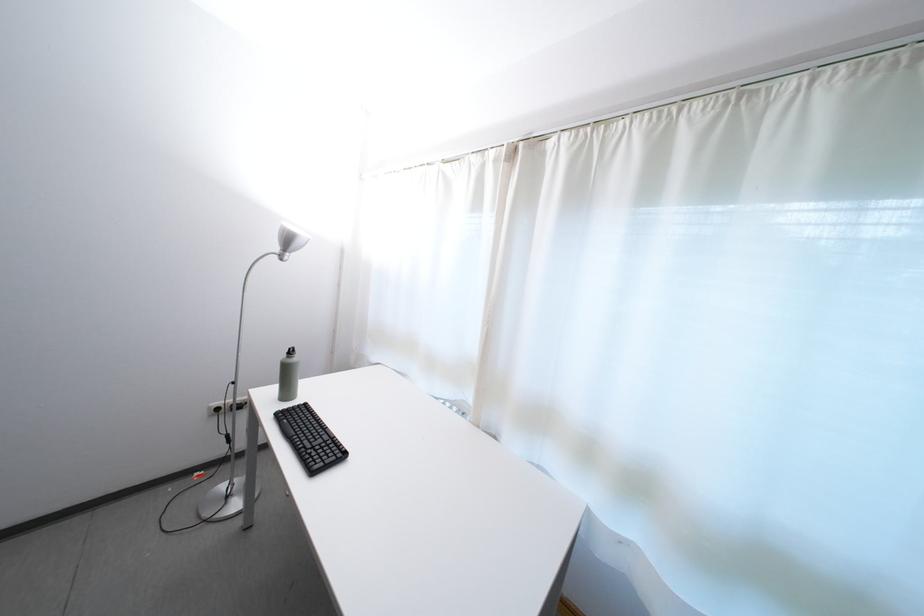
You are a GUI agent. You are given a task and a screenshot of the screen. Output one action in this format:
    pyautogui.click(x=<x>, y=<y>)
    Task: Click on the silver lamp head
    
    Given the screenshot: What is the action you would take?
    pyautogui.click(x=289, y=240)